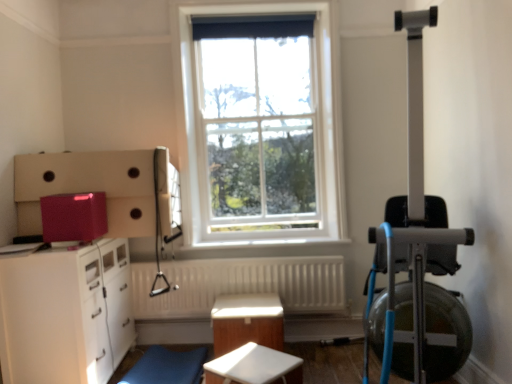
What are the coordinates of `vacant space underneath white textured radiator at center (from a real-world perspective)` in the screenshot? It's located at (212, 327).